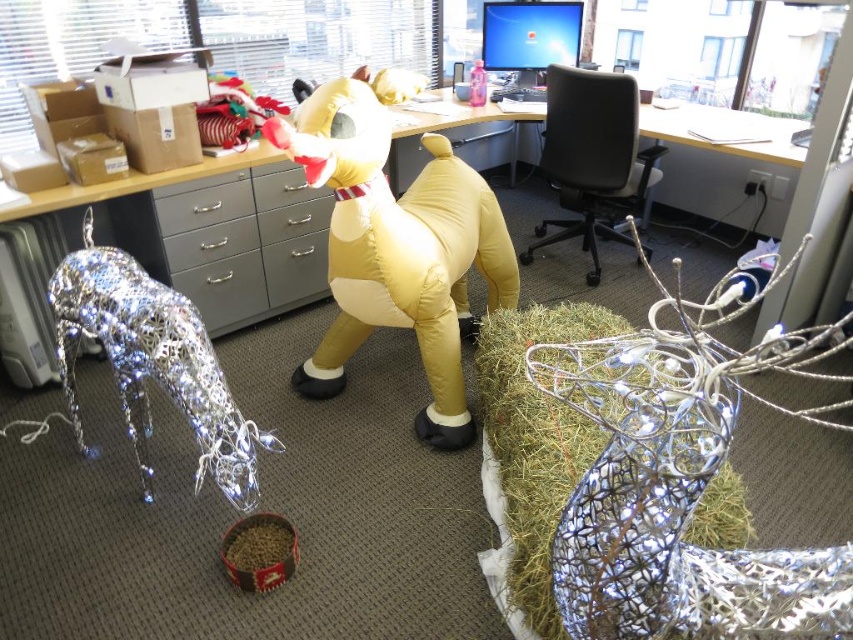
You are organizing a holiday party in the office and need to place decorations. You have a silvery metallic hay at lower right and a matte gray computer desk at center. Which object takes up less space in the office?

The silvery metallic hay at lower right is smaller than the matte gray computer desk at center, so it takes up less space in the office.

You are organizing a holiday party and need to place the yellow inflatable dog at center and the metallic wire reindeer at left in a way that the bigger one is in the front for visibility. Which object should be placed in front?

The yellow inflatable dog at center is bigger than the metallic wire reindeer at left, so it should be placed in front to ensure visibility.

You are an office worker who wants to place a new decoration between the yellow inflatable dog at center and the metallic wire reindeer at left. Based on their positions, where should you place the new decoration?

The yellow inflatable dog at center is to the right of the metallic wire reindeer at left, so you should place the new decoration between them, closer to the center where the yellow inflatable dog is positioned.